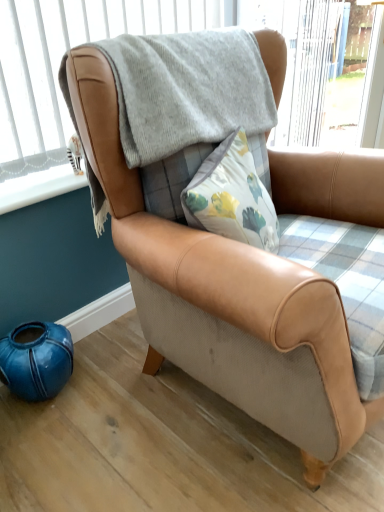
Measure the distance between white plastic window sill at lower left and camera.

The depth of white plastic window sill at lower left is 1.24 meters.

Image resolution: width=384 pixels, height=512 pixels. What do you see at coordinates (38, 187) in the screenshot?
I see `white plastic window sill at lower left` at bounding box center [38, 187].

Find the location of `white plastic window sill at lower left`. white plastic window sill at lower left is located at coordinates (38, 187).

What do you see at coordinates (181, 31) in the screenshot?
I see `plaid fabric window frame at upper center` at bounding box center [181, 31].

Where is `plaid fabric window frame at upper center`? The height and width of the screenshot is (512, 384). plaid fabric window frame at upper center is located at coordinates (181, 31).

The image size is (384, 512). I want to click on white plastic window sill at lower left, so click(38, 187).

Is plaid fabric window frame at upper center at the left side of white plastic window sill at lower left?

No, plaid fabric window frame at upper center is not to the left of white plastic window sill at lower left.

Relative to white plastic window sill at lower left, is plaid fabric window frame at upper center in front or behind?

plaid fabric window frame at upper center is in front of white plastic window sill at lower left.

Between point (350, 38) and point (53, 192), which one is positioned in front?

The point (53, 192) is in front.

From the image's perspective, which object appears higher, plaid fabric window frame at upper center or white plastic window sill at lower left?

plaid fabric window frame at upper center is shown above in the image.

From a real-world perspective, is plaid fabric window frame at upper center below white plastic window sill at lower left?

No, from a real-world perspective, plaid fabric window frame at upper center is not under white plastic window sill at lower left.

In terms of width, does plaid fabric window frame at upper center look wider or thinner when compared to white plastic window sill at lower left?

Clearly, plaid fabric window frame at upper center has more width compared to white plastic window sill at lower left.

Which of these two, plaid fabric window frame at upper center or white plastic window sill at lower left, stands taller?

plaid fabric window frame at upper center is taller.

Looking at this image, does plaid fabric window frame at upper center have a smaller size compared to white plastic window sill at lower left?

No.

Is plaid fabric window frame at upper center not inside white plastic window sill at lower left?

Yes, plaid fabric window frame at upper center is not within white plastic window sill at lower left.

Is plaid fabric window frame at upper center in contact with white plastic window sill at lower left?

plaid fabric window frame at upper center is not next to white plastic window sill at lower left, and they're not touching.

Is plaid fabric window frame at upper center oriented away from white plastic window sill at lower left?

That's right, plaid fabric window frame at upper center is facing away from white plastic window sill at lower left.

How different are the orientations of plaid fabric window frame at upper center and white plastic window sill at lower left in degrees?

4.5 degrees separate the facing orientations of plaid fabric window frame at upper center and white plastic window sill at lower left.

How far apart are plaid fabric window frame at upper center and white plastic window sill at lower left?

A distance of 41.77 centimeters exists between plaid fabric window frame at upper center and white plastic window sill at lower left.

Where is `window sill below the plaid fabric window frame at upper center (from the image's perspective)`? This screenshot has height=512, width=384. window sill below the plaid fabric window frame at upper center (from the image's perspective) is located at coordinates (38, 187).

Would you say white plastic window sill at lower left is to the left or to the right of plaid fabric window frame at upper center in the picture?

white plastic window sill at lower left is to the left of plaid fabric window frame at upper center.

Which object is further away from the camera taking this photo, white plastic window sill at lower left or plaid fabric window frame at upper center?

Positioned behind is white plastic window sill at lower left.

Which is more distant, [34,190] or [81,37]?

The point [81,37] is more distant.

From the image's perspective, is white plastic window sill at lower left positioned above or below plaid fabric window frame at upper center?

Clearly, from the image's perspective, white plastic window sill at lower left is below plaid fabric window frame at upper center.

From a real-world perspective, is white plastic window sill at lower left on top of plaid fabric window frame at upper center?

Incorrect, from a real-world perspective, white plastic window sill at lower left is lower than plaid fabric window frame at upper center.

Which of these two, white plastic window sill at lower left or plaid fabric window frame at upper center, is wider?

Wider between the two is plaid fabric window frame at upper center.

Can you confirm if white plastic window sill at lower left is taller than plaid fabric window frame at upper center?

No.

Who is bigger, white plastic window sill at lower left or plaid fabric window frame at upper center?

plaid fabric window frame at upper center.

Do you think white plastic window sill at lower left is within plaid fabric window frame at upper center, or outside of it?

white plastic window sill at lower left lies outside plaid fabric window frame at upper center.

Are white plastic window sill at lower left and plaid fabric window frame at upper center located far from each other?

Actually, white plastic window sill at lower left and plaid fabric window frame at upper center are a little close together.

Is plaid fabric window frame at upper center at the back of white plastic window sill at lower left?

white plastic window sill at lower left is not turned away from plaid fabric window frame at upper center.

Image resolution: width=384 pixels, height=512 pixels. What are the coordinates of `window sill that appears below the plaid fabric window frame at upper center (from a real-world perspective)` in the screenshot? It's located at (38, 187).

The image size is (384, 512). Find the location of `window frame that is in front of the white plastic window sill at lower left`. window frame that is in front of the white plastic window sill at lower left is located at coordinates (181, 31).

The width and height of the screenshot is (384, 512). I want to click on window frame that is on the right side of white plastic window sill at lower left, so click(x=181, y=31).